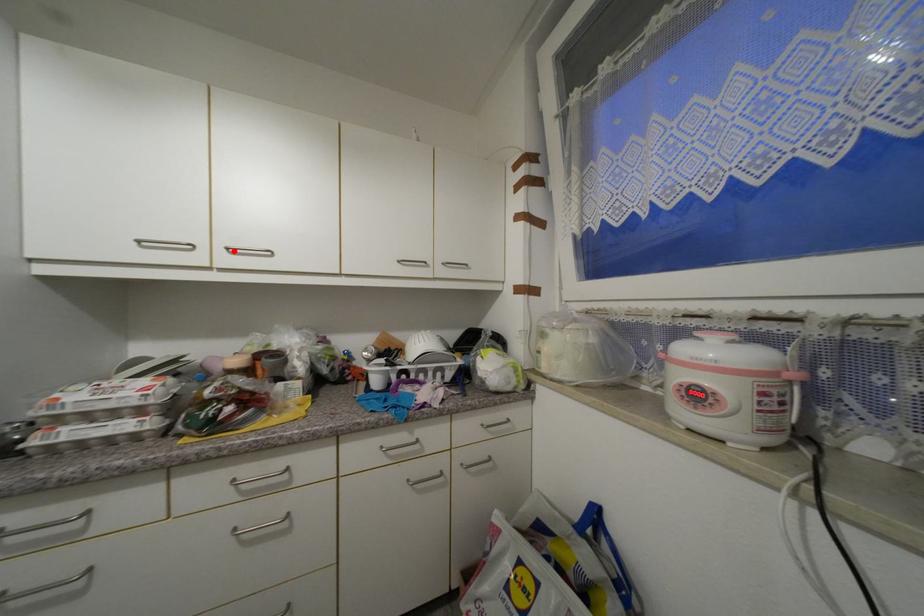
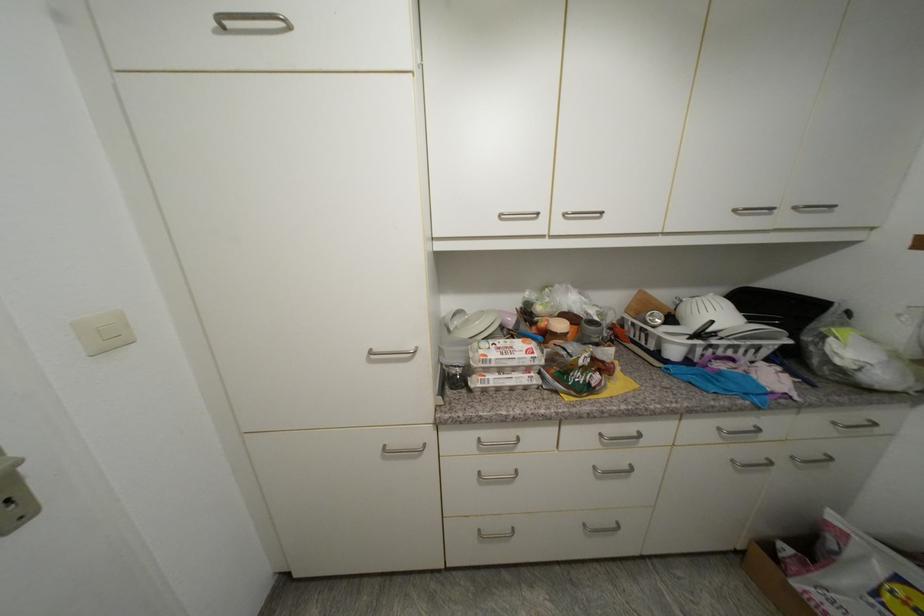
Where in the second image is the point corresponding to the highlighted location from the first image?

(570, 216)